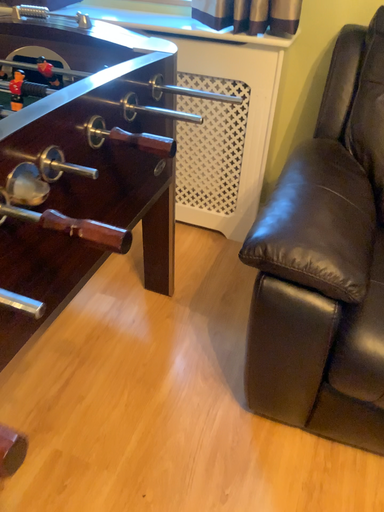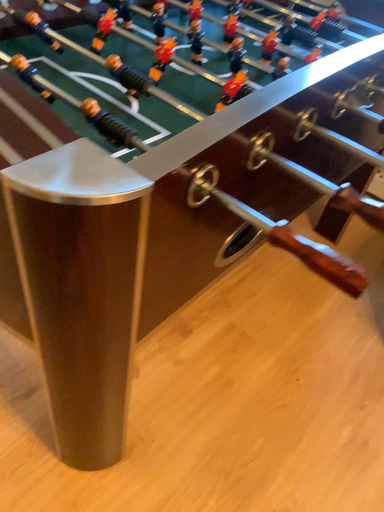
Question: Which way did the camera rotate in the video?

Choices:
 (A) rotated left
 (B) rotated right

Answer: (A)